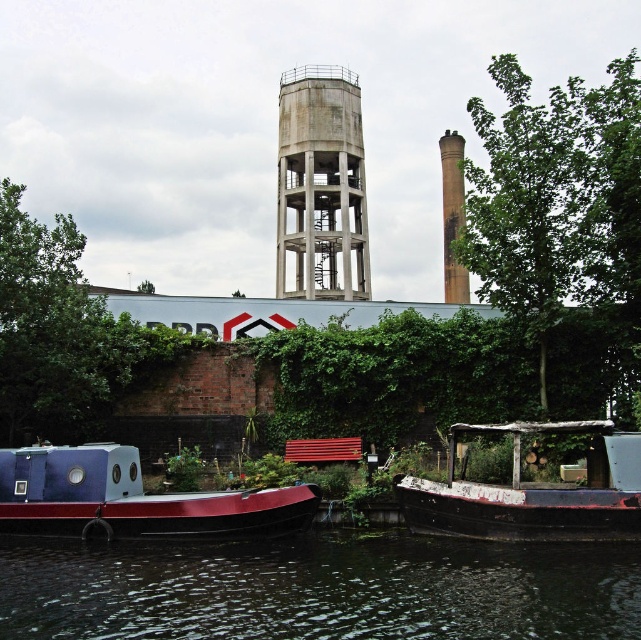
Question: Which point appears farthest from the camera in this image?

Choices:
 (A) (162, 545)
 (B) (451, 224)
 (C) (617, 508)

Answer: (B)

Question: Observing the image, what is the correct spatial positioning of dark green water at lower center in reference to brown textured chimney at upper right?

Choices:
 (A) below
 (B) above

Answer: (A)

Question: Can you confirm if concrete water tower at center is positioned to the right of rusty wooden boat at lower right?

Choices:
 (A) no
 (B) yes

Answer: (A)

Question: Does dark green water at lower center appear on the left side of rusty wooden boat at lower right?

Choices:
 (A) yes
 (B) no

Answer: (A)

Question: Which point appears closest to the camera in this image?

Choices:
 (A) (453, 264)
 (B) (394, 580)
 (C) (349, 275)
 (D) (603, 428)

Answer: (B)

Question: Which object is closer to the camera taking this photo?

Choices:
 (A) dark green water at lower center
 (B) rusty wooden boat at lower right
 (C) concrete water tower at center
 (D) brown textured chimney at upper right

Answer: (A)